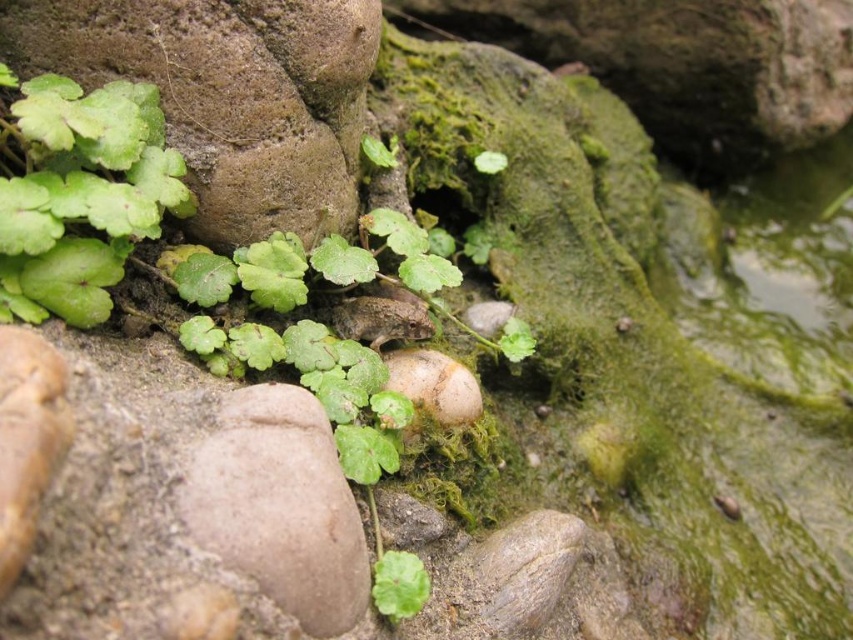
Between brown rough stone at center-left and green matte leaf at upper left, which one is positioned lower?

green matte leaf at upper left is below.

Does point (206, 241) come closer to viewer compared to point (59, 314)?

No.

What do you see at coordinates (228, 96) in the screenshot?
I see `brown rough stone at center-left` at bounding box center [228, 96].

Locate an element on the screen. This screenshot has width=853, height=640. brown rough stone at center-left is located at coordinates (228, 96).